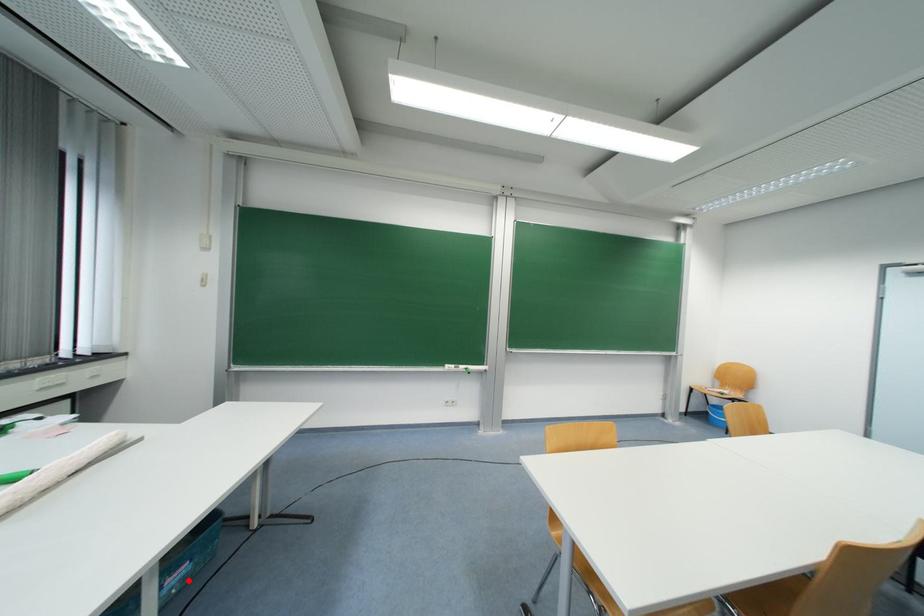
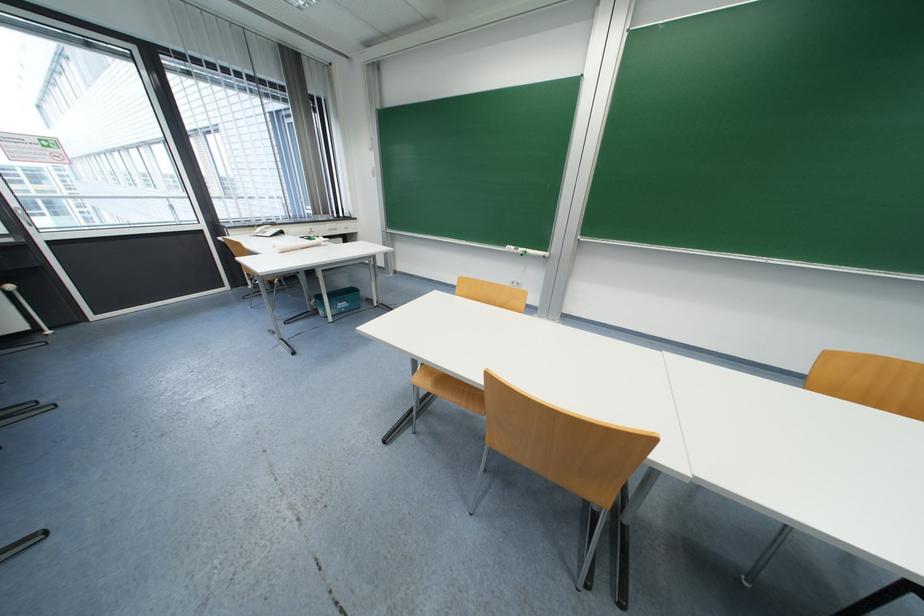
Question: I am providing you with two images of the same scene from different viewpoints. A red point is shown in image1. For the corresponding object point in image2, is it positioned nearer or farther from the camera?

Choices:
 (A) Nearer
 (B) Farther

Answer: (B)